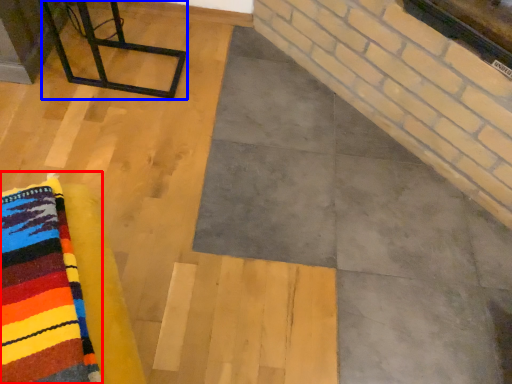
Question: Which point is further to the camera, cloth (highlighted by a red box) or furniture (highlighted by a blue box)?

Choices:
 (A) cloth
 (B) furniture

Answer: (B)